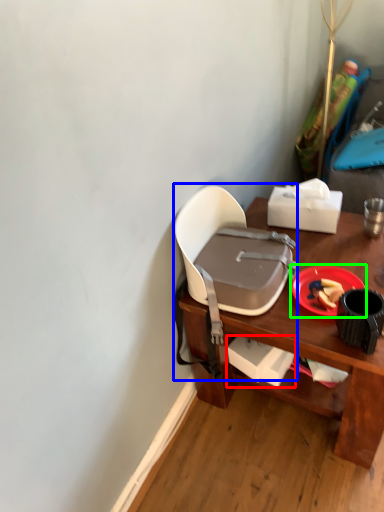
Question: Which object is the closest to the box (highlighted by a red box)? Choose among these: chair (highlighted by a blue box) or plate (highlighted by a green box).

Choices:
 (A) chair
 (B) plate

Answer: (A)